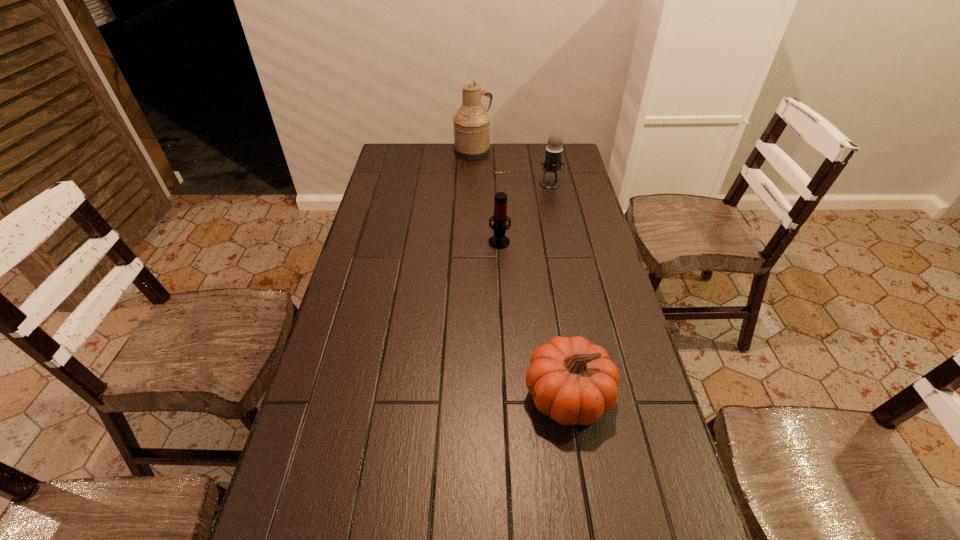
Find the location of `free region located 0.310m on the face of the nearest object`. free region located 0.310m on the face of the nearest object is located at coordinates (396, 396).

Locate an element on the screen. free space located 0.270m on the face of the nearest object is located at coordinates (413, 396).

This screenshot has height=540, width=960. I want to click on free space located 0.340m on the face of the nearest object, so coord(384,396).

At what (x,y) coordinates should I click in order to perform the action: click on object present at the far edge. Please return your answer as a coordinate pair (x, y). Looking at the image, I should click on (471, 123).

Where is `microphone at the right edge`? This screenshot has width=960, height=540. microphone at the right edge is located at coordinates (552, 163).

You are a GUI agent. You are given a task and a screenshot of the screen. Output one action in this format:
    pyautogui.click(x=<x>, y=<y>)
    Task: Click on the pumpkin present at the right edge
    
    Given the screenshot: What is the action you would take?
    pyautogui.click(x=571, y=380)

The height and width of the screenshot is (540, 960). What are the coordinates of `vacant region at the far edge` in the screenshot? It's located at (533, 151).

You are a GUI agent. You are given a task and a screenshot of the screen. Output one action in this format:
    pyautogui.click(x=<x>, y=<y>)
    Task: Click on the free space at the left edge
    
    Given the screenshot: What is the action you would take?
    pyautogui.click(x=342, y=357)

The width and height of the screenshot is (960, 540). In the image, there is a desktop. Identify the location of vacant space at the right edge. (608, 436).

The image size is (960, 540). Find the location of `free space at the far left corner`. free space at the far left corner is located at coordinates (419, 159).